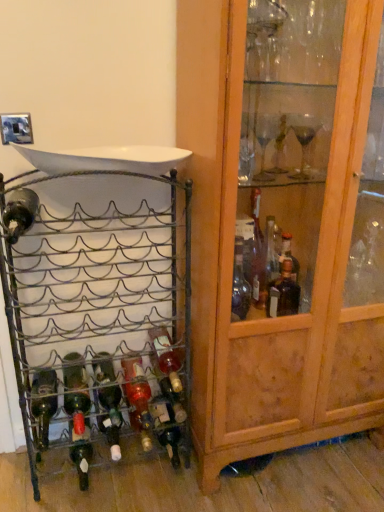
Question: Is green glass bottle at lower left, the 5th bottle when ordered from right to left, situated inside wooden cabinet at right or outside?

Choices:
 (A) outside
 (B) inside

Answer: (A)

Question: From the image's perspective, relative to wooden cabinet at right, is green glass bottle at lower left, the 5th bottle when ordered from right to left, above or below?

Choices:
 (A) above
 (B) below

Answer: (B)

Question: Estimate the real-world distances between objects in this image. Which object is closer to the translucent glass bottle at center, arranged as the 6th bottle when viewed from the left?

Choices:
 (A) metallic wire wine rack at left
 (B) wooden cabinet at right
 (C) translucent glass bottle at center, the fifth bottle when ordered from left to right
 (D) translucent glass bottle at lower left, arranged as the 4th bottle when viewed from the right
 (E) green glass bottle at center, marked as the fourth bottle in a left-to-right arrangement

Answer: (C)

Question: Which object is the farthest from the metallic wire wine rack at left?

Choices:
 (A) translucent glass bottle at center, arranged as the 6th bottle when viewed from the left
 (B) translucent glass bottle at center, the fifth bottle when ordered from left to right
 (C) green glass bottle at lower left, the first bottle in the left-to-right sequence
 (D) translucent glass bottle at lower left, arranged as the 4th bottle when viewed from the right
 (E) green glass bottle at lower left, which is the second bottle from left to right

Answer: (D)